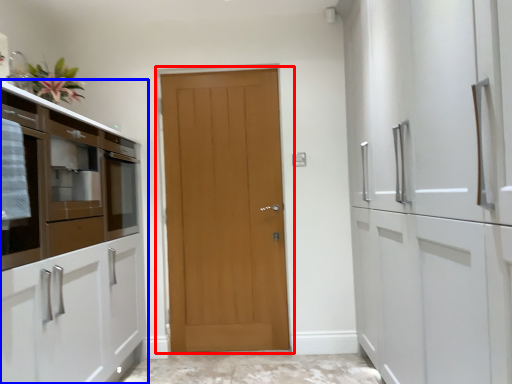
Question: Which object appears closest to the camera in this image, door (highlighted by a red box) or cabinetry (highlighted by a blue box)?

Choices:
 (A) door
 (B) cabinetry

Answer: (B)